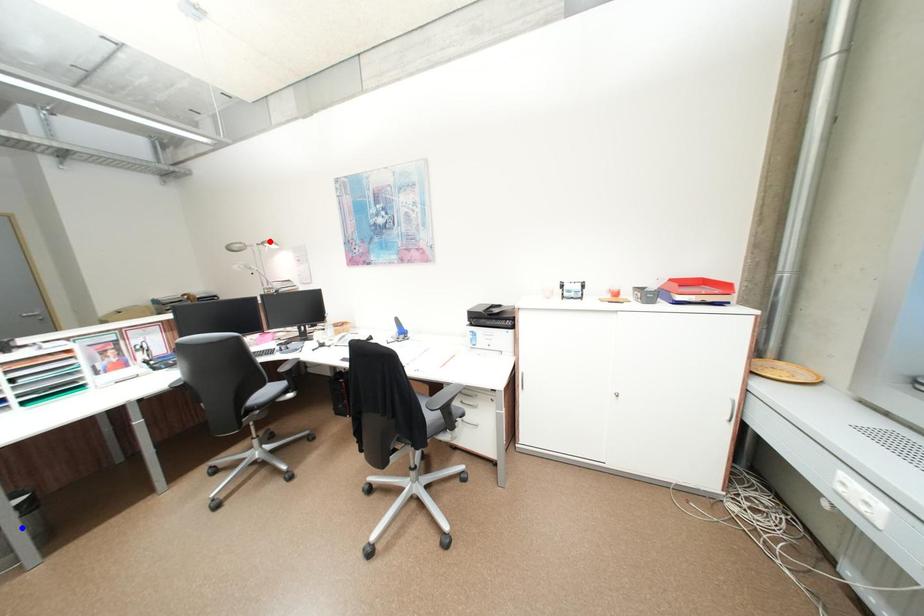
Question: In the image, two points are highlighted. Which point is nearer to the camera? Reply with the corresponding letter.

Choices:
 (A) blue point
 (B) red point

Answer: (A)